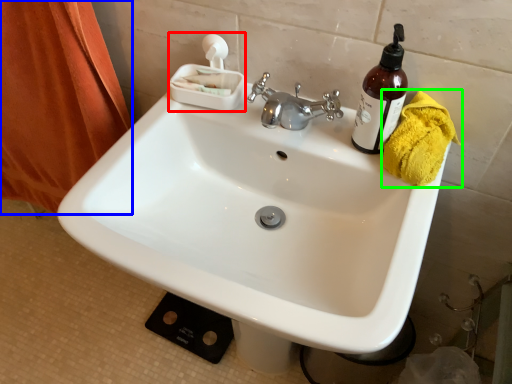
Question: Which object is positioned closest to tissue (highlighted by a red box)? Select from shower curtain (highlighted by a blue box) and bath towel (highlighted by a green box).

Choices:
 (A) shower curtain
 (B) bath towel

Answer: (B)